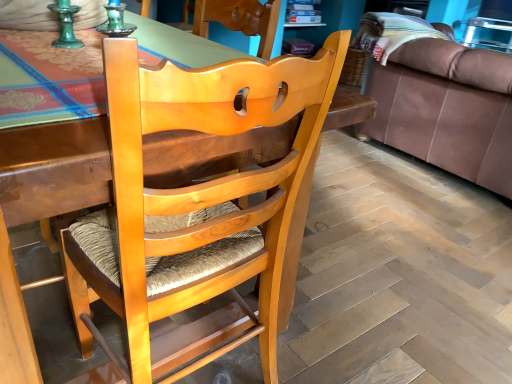
Question: Is point (501, 107) positioned closer to the camera than point (117, 283)?

Choices:
 (A) farther
 (B) closer

Answer: (A)

Question: Is brown leather couch at right situated inside light brown wood chair at center or outside?

Choices:
 (A) inside
 (B) outside

Answer: (B)

Question: Is brown leather couch at right to the left or to the right of light brown wood chair at center in the image?

Choices:
 (A) left
 (B) right

Answer: (B)

Question: Is light brown wood chair at center inside or outside of brown leather couch at right?

Choices:
 (A) inside
 (B) outside

Answer: (B)

Question: Is light brown wood chair at center in front of or behind brown leather couch at right in the image?

Choices:
 (A) front
 (B) behind

Answer: (A)

Question: Considering the positions of light brown wood chair at center and brown leather couch at right in the image, is light brown wood chair at center taller or shorter than brown leather couch at right?

Choices:
 (A) short
 (B) tall

Answer: (B)

Question: From a real-world perspective, is light brown wood chair at center physically located above or below brown leather couch at right?

Choices:
 (A) above
 (B) below

Answer: (A)